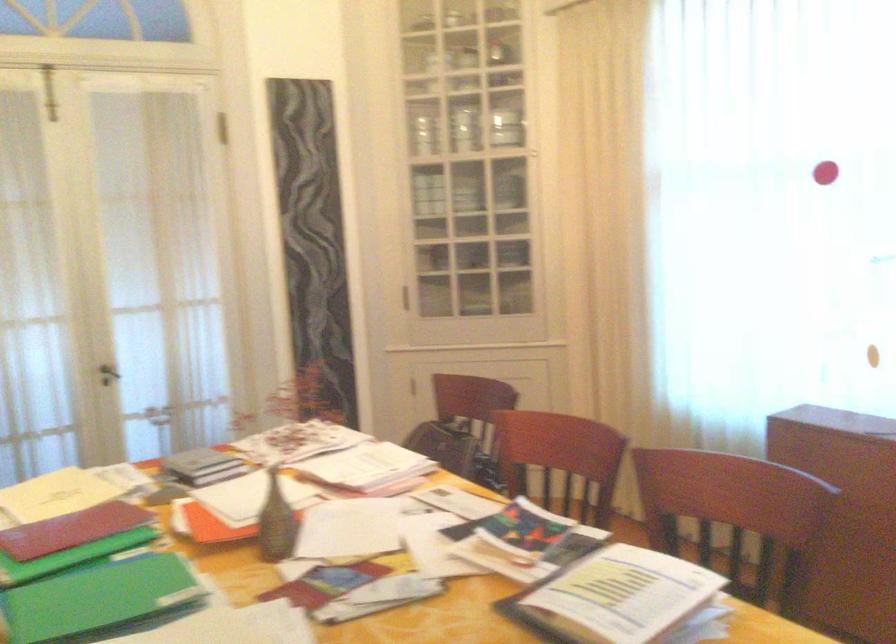
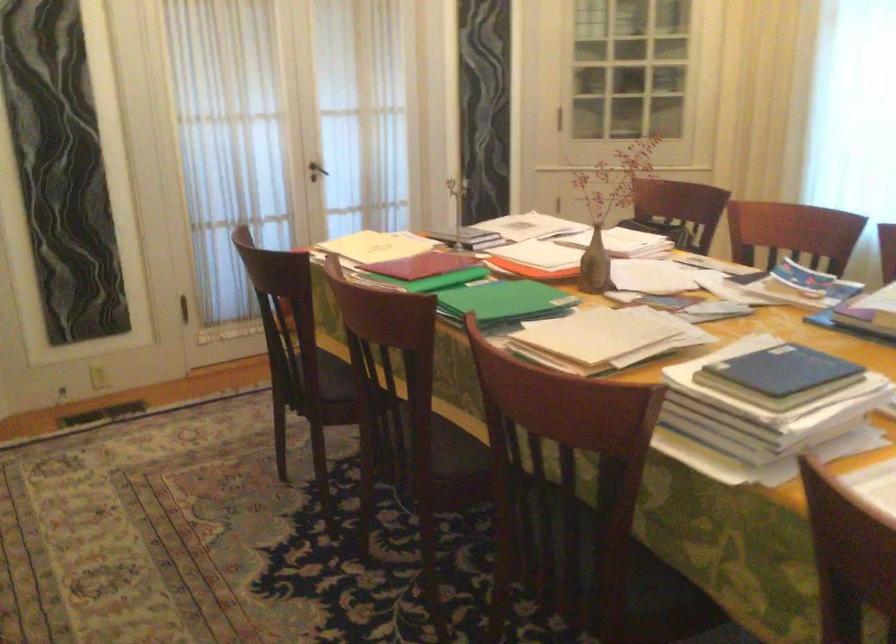
Where in the second image is the point corresponding to [107,374] from the first image?

(316, 171)